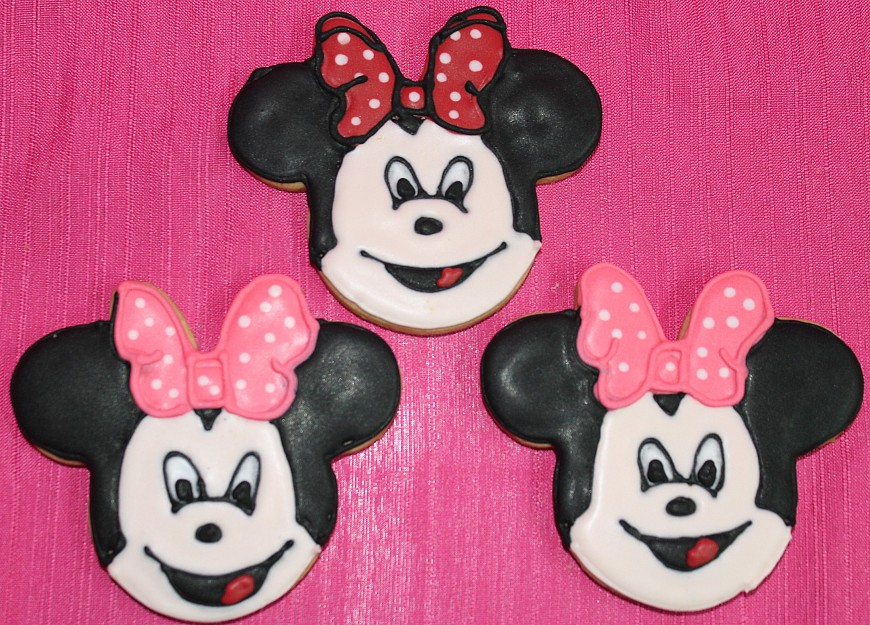
Where is `wooden table`? This screenshot has height=625, width=870. wooden table is located at coordinates (723, 162), (409, 596), (82, 195).